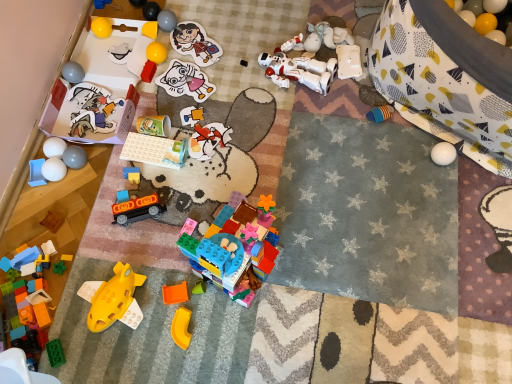
At what (x,y) coordinates should I click in order to perform the action: click on spots to the right of matte paper sticker at upper center, which is counted as the twentieth toy, starting from the left. Please return your answer as a coordinate pair (x, y). Image resolution: width=512 pixels, height=384 pixels. Looking at the image, I should click on (244, 48).